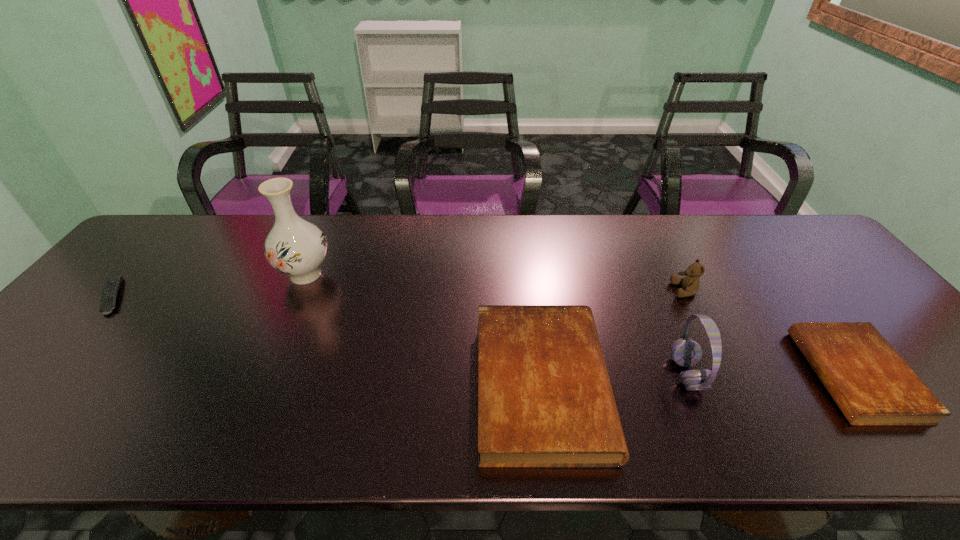
Where is `vacant place for an extra Bible on the left`? vacant place for an extra Bible on the left is located at coordinates (216, 395).